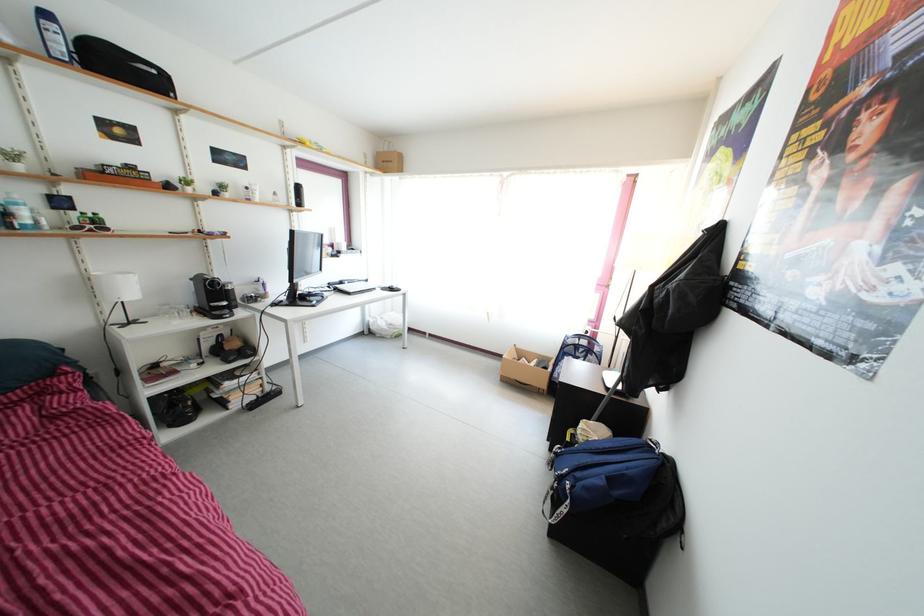
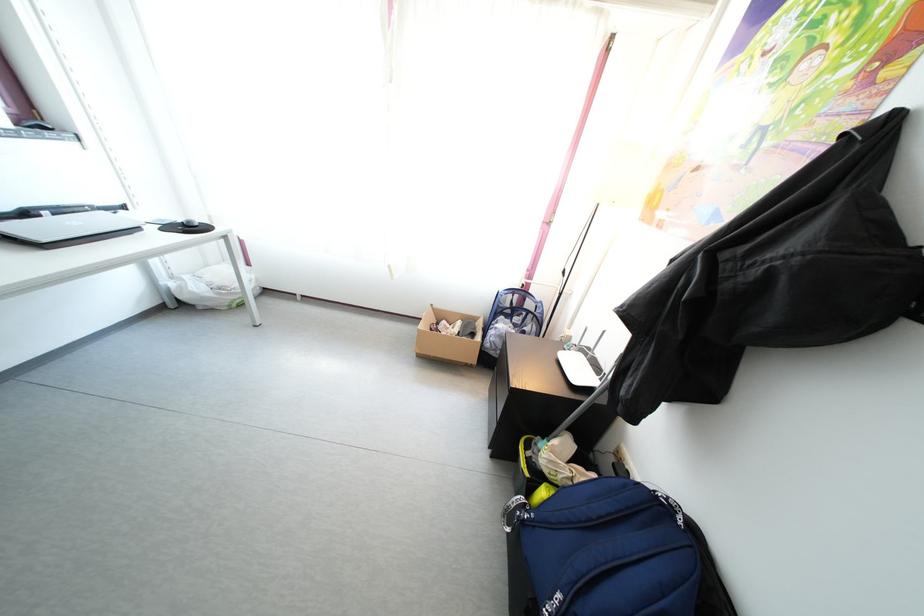
Where in the second image is the point corresponding to pixel 347 291 from the first image?

(31, 222)